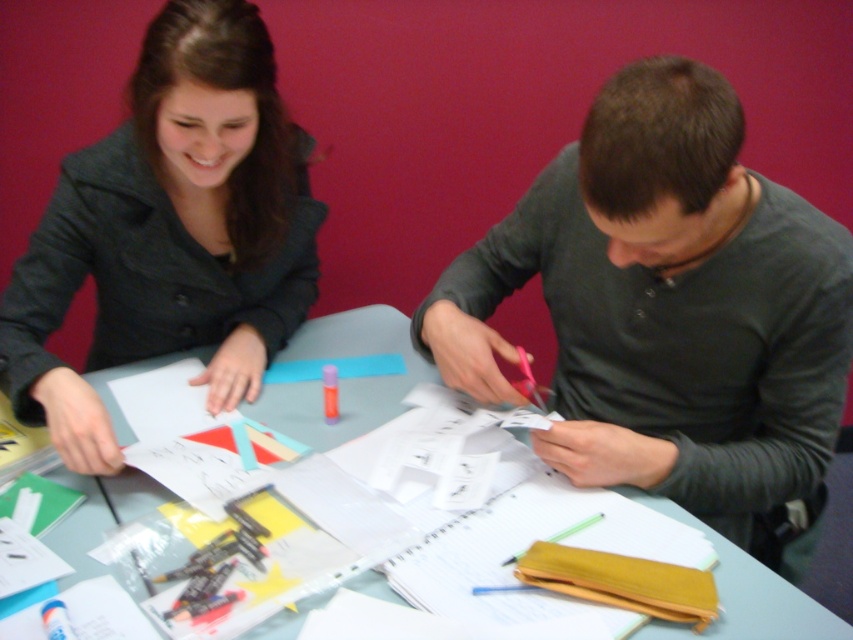
Does dark gray shirt at center appear under light blue plastic table at center?

Incorrect, dark gray shirt at center is not positioned below light blue plastic table at center.

Where is `dark gray shirt at center`? dark gray shirt at center is located at coordinates (669, 310).

This screenshot has width=853, height=640. In order to click on dark gray shirt at center in this screenshot , I will do `click(669, 310)`.

Who is taller, dark gray shirt at center or matte gray coat at upper left?

dark gray shirt at center

Does point (773, 477) come closer to viewer compared to point (32, 285)?

Yes, point (773, 477) is closer to viewer.

Which is in front, point (788, 273) or point (57, 260)?

Point (788, 273) is in front.

Where is `dark gray shirt at center`? dark gray shirt at center is located at coordinates (669, 310).

Which is more to the right, matte gray coat at upper left or light blue plastic table at center?

From the viewer's perspective, light blue plastic table at center appears more on the right side.

Which of these two, matte gray coat at upper left or light blue plastic table at center, stands taller?

With more height is matte gray coat at upper left.

The width and height of the screenshot is (853, 640). What do you see at coordinates (170, 230) in the screenshot?
I see `matte gray coat at upper left` at bounding box center [170, 230].

I want to click on matte gray coat at upper left, so click(170, 230).